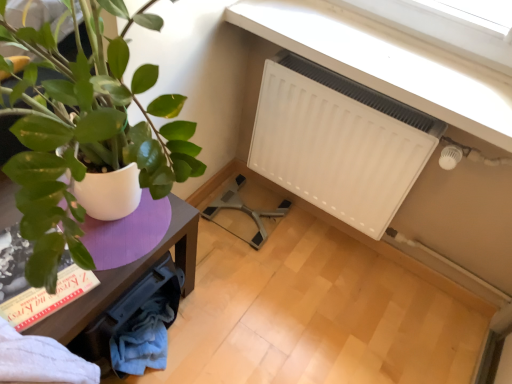
Question: From the image's perspective, is purple wood table at left above or below white plastic radiator at upper right?

Choices:
 (A) above
 (B) below

Answer: (B)

Question: Is purple wood table at left taller or shorter than white plastic radiator at upper right?

Choices:
 (A) short
 (B) tall

Answer: (B)

Question: Which is nearer to the white matte radiator at upper right?

Choices:
 (A) hardcover book at lower left
 (B) purple wood table at left
 (C) white plastic radiator at upper right

Answer: (C)

Question: Estimate the real-world distances between objects in this image. Which object is closer to the purple wood table at left?

Choices:
 (A) white matte radiator at upper right
 (B) hardcover book at lower left
 (C) white plastic radiator at upper right

Answer: (B)